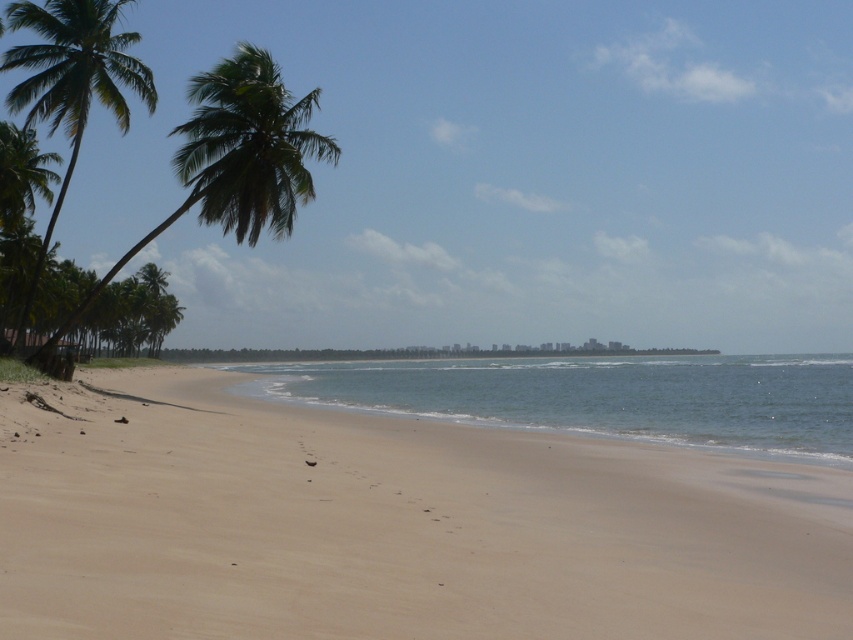
In the scene shown: You are standing at the shoreline and want to walk to the green leafy palm tree at left. Which direction should you move relative to the beige sand at lower center?

You should move to the left relative to the beige sand at lower center because the green leafy palm tree at left is positioned on the left side of the beige sand at lower center.

You are standing on the beach and want to walk from the beige sand at lower center to the green leafy palm tree at left. Based on the scene description, which direction should you move in to reach the palm tree?

Since the beige sand at lower center is narrower than the green leafy palm tree at left, you should move towards the left to reach the palm tree.